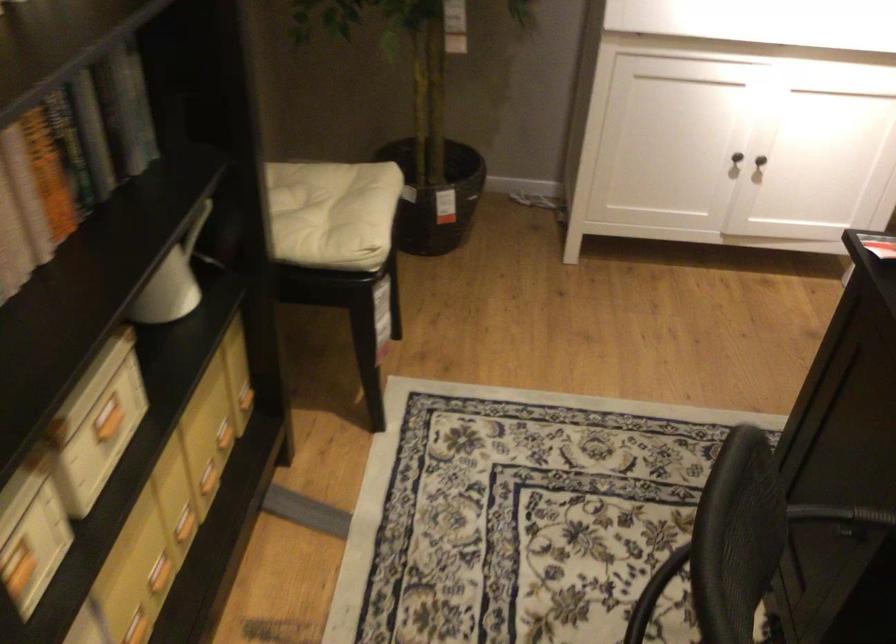
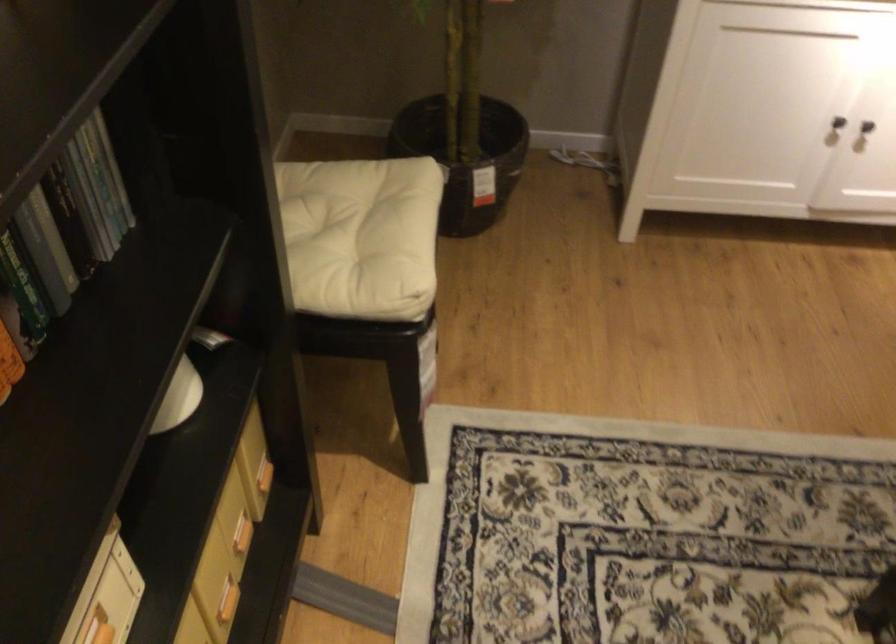
Locate, in the second image, the point that corresponds to the point at 88,144 in the first image.

(30, 240)